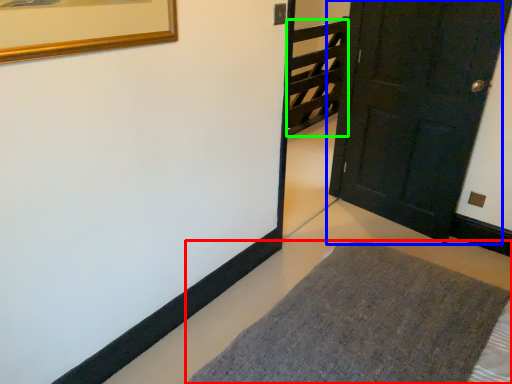
Question: Which is nearer to the furniture (highlighted by a red box)? door (highlighted by a blue box) or stairwell (highlighted by a green box).

Choices:
 (A) door
 (B) stairwell

Answer: (A)